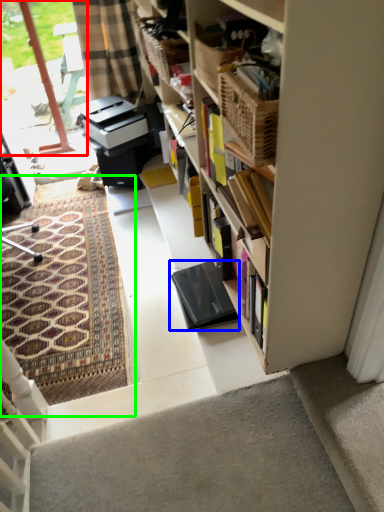
Question: Which is nearer to the glass door (highlighted by a red box)? equipment (highlighted by a blue box) or doormat (highlighted by a green box).

Choices:
 (A) equipment
 (B) doormat

Answer: (B)